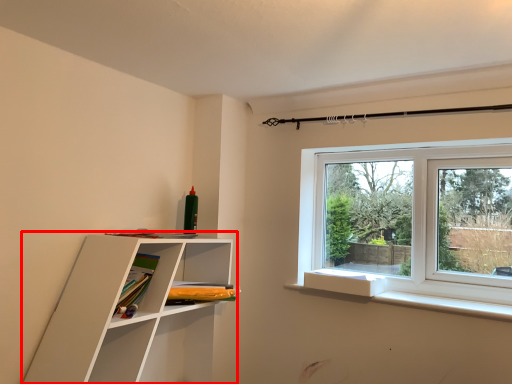
Question: Considering the relative positions of shelf (annotated by the red box) and book in the image provided, where is shelf (annotated by the red box) located with respect to the staircase?

Choices:
 (A) right
 (B) left

Answer: (B)